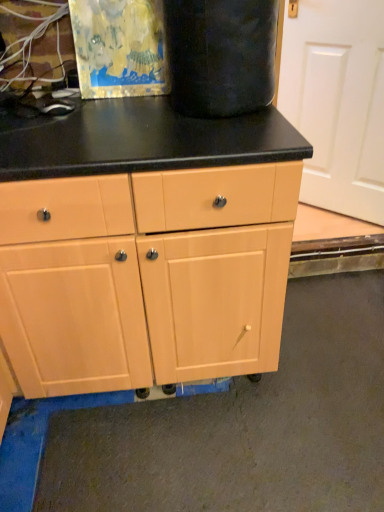
The width and height of the screenshot is (384, 512). What are the coordinates of `vacant space situated above matte wood cabinet at center (from a real-world perspective)` in the screenshot? It's located at (122, 128).